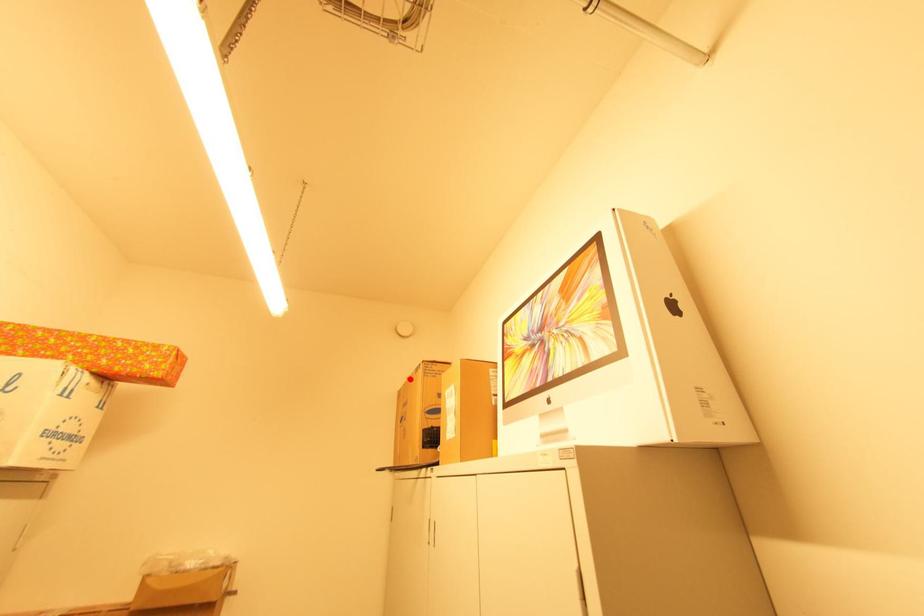
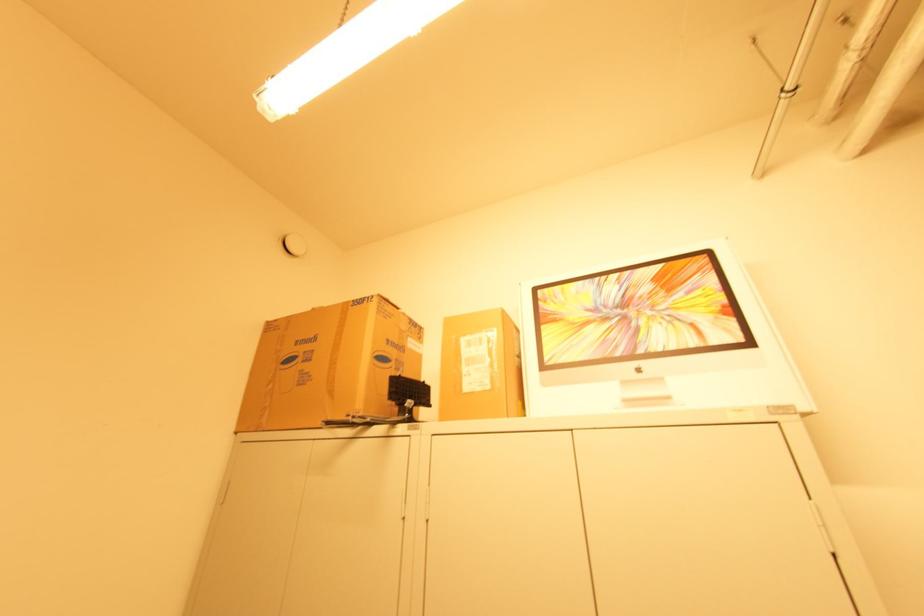
Locate, in the second image, the point that corresponds to the highlighted location in the first image.

(315, 309)